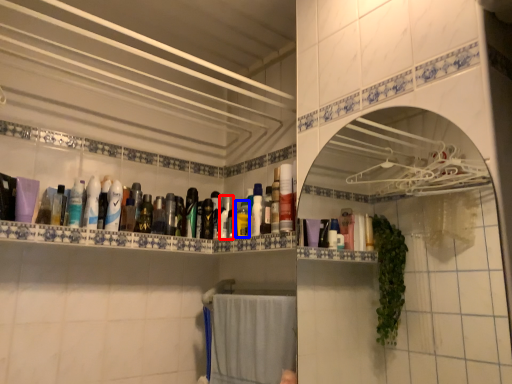
Question: Which object is further to the camera taking this photo, toiletry (highlighted by a red box) or mouthwash (highlighted by a blue box)?

Choices:
 (A) toiletry
 (B) mouthwash

Answer: (A)